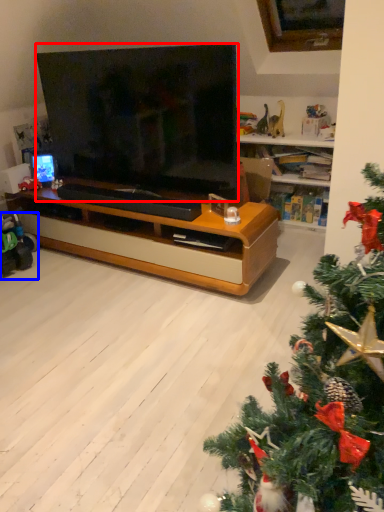
Question: Which of the following is the closest to the observer, television (highlighted by a red box) or toy (highlighted by a blue box)?

Choices:
 (A) television
 (B) toy

Answer: (A)